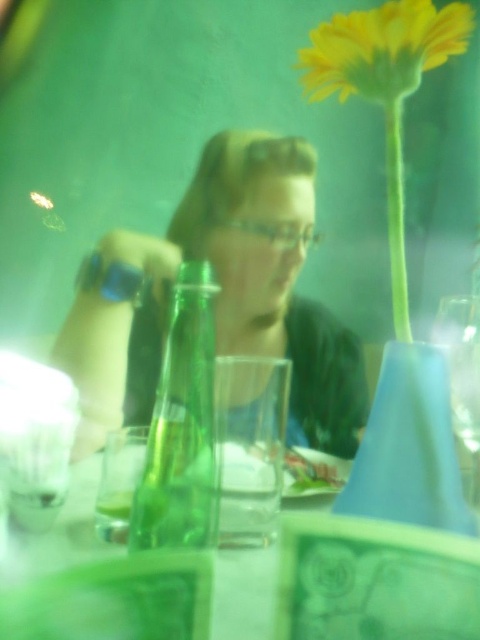
Who is shorter, transparent plastic table at center or transparent glass wine glass at right?

transparent plastic table at center

Is transparent plastic table at center smaller than transparent glass wine glass at right?

Incorrect, transparent plastic table at center is not smaller in size than transparent glass wine glass at right.

Between point (28, 572) and point (445, 326), which one is positioned in front?

Positioned in front is point (28, 572).

Locate an element on the screen. Image resolution: width=480 pixels, height=640 pixels. transparent plastic table at center is located at coordinates (61, 532).

Does yellow matte flower at upper right have a larger size compared to transparent plastic table at center?

No, yellow matte flower at upper right is not bigger than transparent plastic table at center.

Can you confirm if yellow matte flower at upper right is positioned below transparent plastic table at center?

Incorrect, yellow matte flower at upper right is not positioned below transparent plastic table at center.

Is point (360, 67) farther from viewer compared to point (96, 483)?

No.

Where is `yellow matte flower at upper right`? This screenshot has height=640, width=480. yellow matte flower at upper right is located at coordinates (382, 49).

Between green glass bottle at center and yellow matte flower at upper right, which one appears on the left side from the viewer's perspective?

Positioned to the left is green glass bottle at center.

Is green glass bottle at center to the left of yellow matte flower at upper right from the viewer's perspective?

Correct, you'll find green glass bottle at center to the left of yellow matte flower at upper right.

This screenshot has height=640, width=480. Identify the location of green glass bottle at center. pos(181,426).